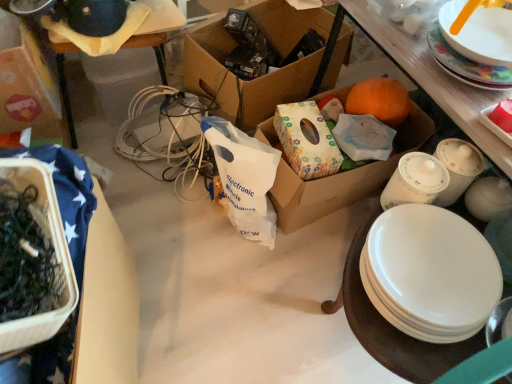
Question: Can you confirm if white glossy plate at upper right, acting as the second plate starting from the bottom, is positioned to the right of cardboard box at center, which is counted as the 4th box, starting from the left?

Choices:
 (A) no
 (B) yes

Answer: (B)

Question: Is white glossy plate at upper right, the first plate when ordered from top to bottom, at the left side of cardboard box at center, arranged as the 1th box when viewed from the right?

Choices:
 (A) no
 (B) yes

Answer: (A)

Question: Is white glossy plate at upper right, acting as the second plate starting from the bottom, wider than cardboard box at center, which is counted as the 4th box, starting from the left?

Choices:
 (A) no
 (B) yes

Answer: (A)

Question: Considering the relative sizes of white glossy plate at upper right, the first plate when ordered from top to bottom, and cardboard box at center, arranged as the 1th box when viewed from the right, in the image provided, is white glossy plate at upper right, the first plate when ordered from top to bottom, smaller than cardboard box at center, arranged as the 1th box when viewed from the right,?

Choices:
 (A) no
 (B) yes

Answer: (B)

Question: Is white glossy plate at upper right, the first plate when ordered from top to bottom, with cardboard box at center, arranged as the 1th box when viewed from the right?

Choices:
 (A) no
 (B) yes

Answer: (A)

Question: Would you say cardboard box at center, which is counted as the 4th box, starting from the left, is part of white glossy plate at upper right, acting as the second plate starting from the bottom,'s contents?

Choices:
 (A) yes
 (B) no

Answer: (B)

Question: From a real-world perspective, does white plastic bag at center sit lower than matte white platter at upper right?

Choices:
 (A) no
 (B) yes

Answer: (B)

Question: Considering the relative sizes of white plastic bag at center and matte white platter at upper right in the image provided, is white plastic bag at center taller than matte white platter at upper right?

Choices:
 (A) no
 (B) yes

Answer: (B)

Question: Is white plastic bag at center positioned beyond the bounds of matte white platter at upper right?

Choices:
 (A) no
 (B) yes

Answer: (B)

Question: Considering the relative sizes of white plastic bag at center and matte white platter at upper right in the image provided, is white plastic bag at center wider than matte white platter at upper right?

Choices:
 (A) no
 (B) yes

Answer: (B)

Question: Is white plastic bag at center directly adjacent to matte white platter at upper right?

Choices:
 (A) yes
 (B) no

Answer: (B)

Question: Can you confirm if white plastic bag at center is positioned to the right of matte white platter at upper right?

Choices:
 (A) no
 (B) yes

Answer: (A)

Question: Can you confirm if matte white platter at upper right is positioned to the right of cardboard box at center, which is counted as the 4th box, starting from the left?

Choices:
 (A) no
 (B) yes

Answer: (B)